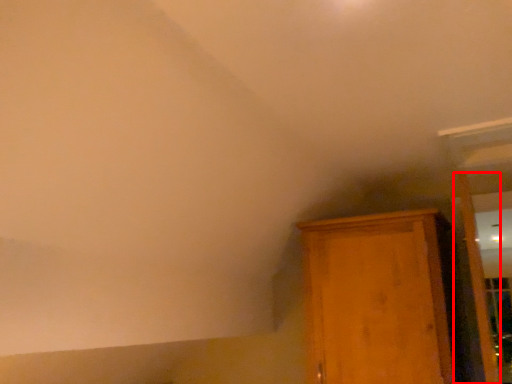
Question: From the image's perspective, what is the correct spatial relationship of door (annotated by the red box) in relation to cupboard?

Choices:
 (A) below
 (B) above

Answer: (B)